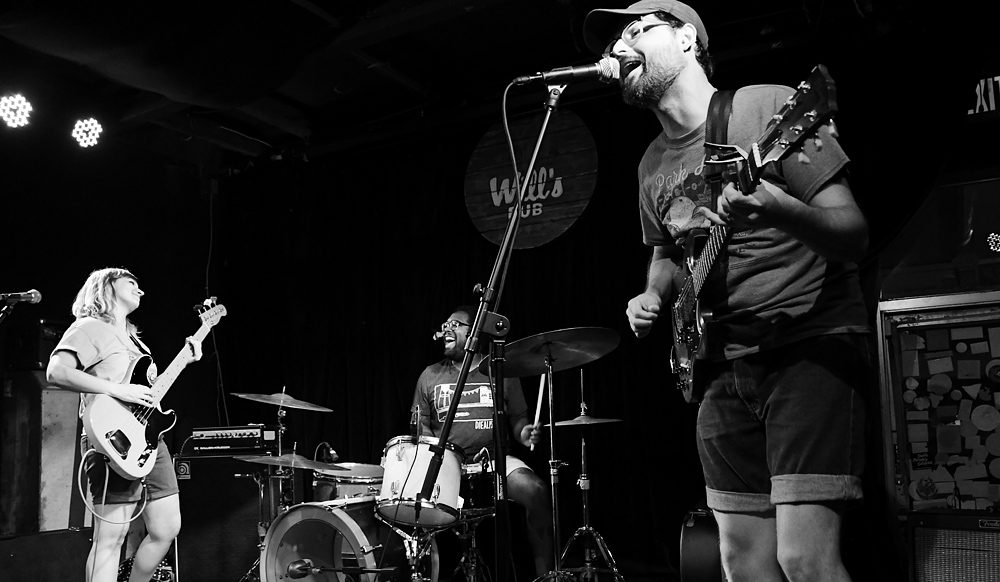
At what (x,y) coordinates should I click in order to perform the action: click on speaker. Please return your answer as a coordinate pair (x, y). Looking at the image, I should click on pos(928,358).